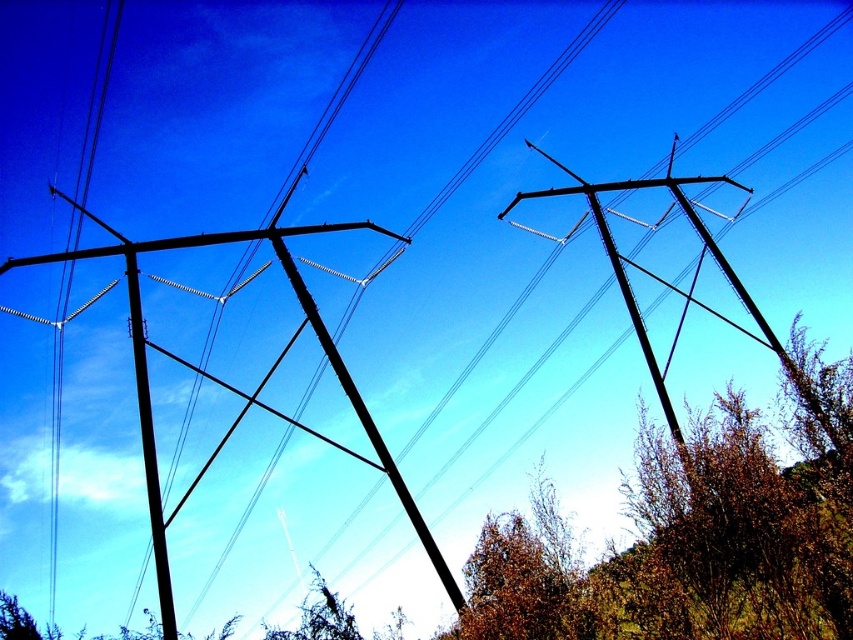
Is brown leafy tree at lower right taller than smooth black telegraph pole at center?

No, brown leafy tree at lower right is not taller than smooth black telegraph pole at center.

Which of these two, brown leafy tree at lower right or smooth black telegraph pole at center, stands taller?

smooth black telegraph pole at center

Image resolution: width=853 pixels, height=640 pixels. What do you see at coordinates (693, 534) in the screenshot?
I see `brown leafy tree at lower right` at bounding box center [693, 534].

Find the location of a particular element. The image size is (853, 640). brown leafy tree at lower right is located at coordinates (693, 534).

Can you confirm if brown leafy tree at lower right is positioned above black metallic telegraph pole at left?

No.

Does brown leafy tree at lower right appear under black metallic telegraph pole at left?

Indeed, brown leafy tree at lower right is positioned under black metallic telegraph pole at left.

Is point (839, 440) less distant than point (39, 257)?

That is True.

Identify the location of brown leafy tree at lower right. Image resolution: width=853 pixels, height=640 pixels. (693, 534).

Consider the image. Which of these two, black metallic telegraph pole at left or smooth black telegraph pole at center, stands taller?

Standing taller between the two is black metallic telegraph pole at left.

Does black metallic telegraph pole at left have a lesser width compared to smooth black telegraph pole at center?

No.

Who is more distant from viewer, (276,227) or (711,176)?

The point (711,176) is behind.

Image resolution: width=853 pixels, height=640 pixels. I want to click on black metallic telegraph pole at left, so click(x=231, y=387).